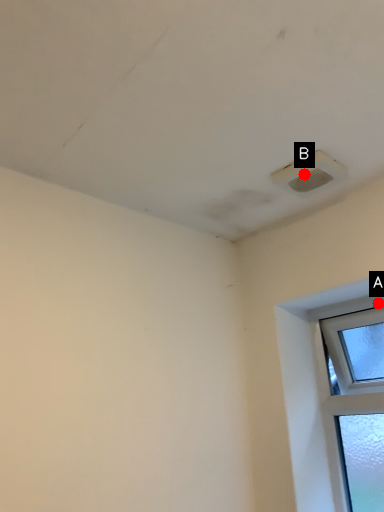
Question: Two points are circled on the image, labeled by A and B beside each circle. Which of the following is the closest to the observer?

Choices:
 (A) A is closer
 (B) B is closer

Answer: (B)